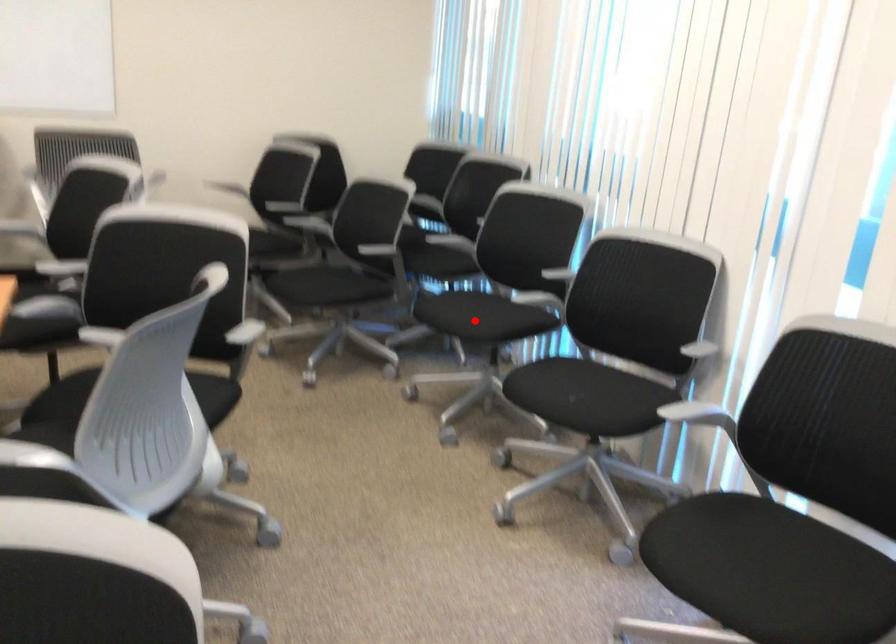
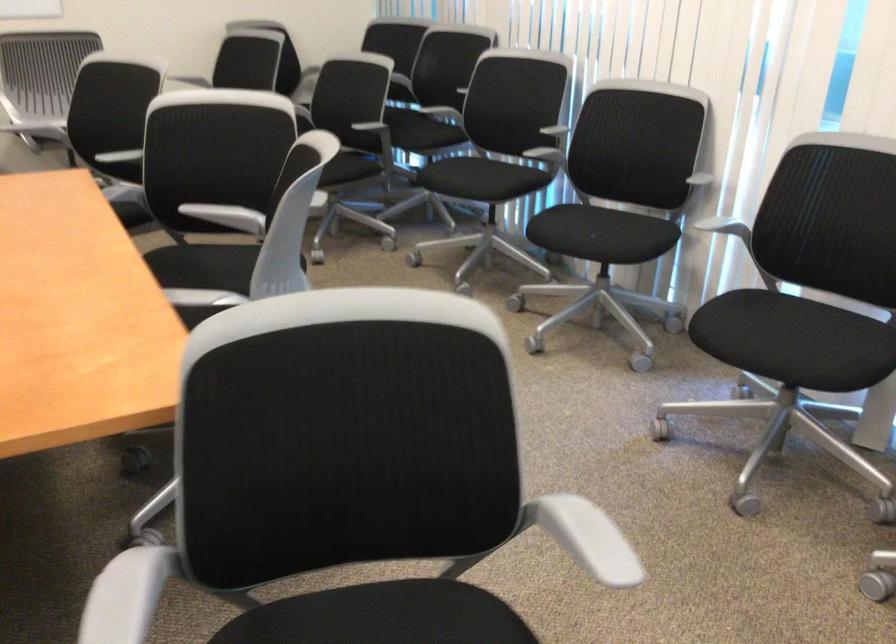
Locate, in the second image, the point that corresponds to the highlighted location in the first image.

(480, 178)